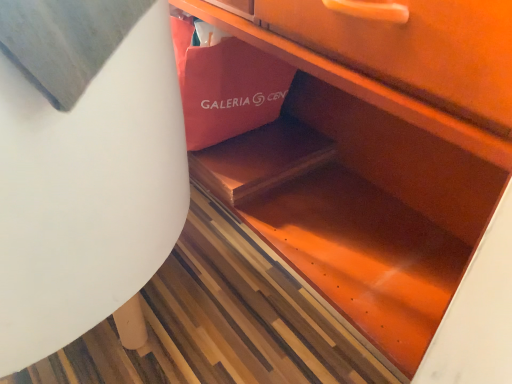
The height and width of the screenshot is (384, 512). In order to click on free space on the front side of matte pink paper bag at center in this screenshot , I will do `click(241, 153)`.